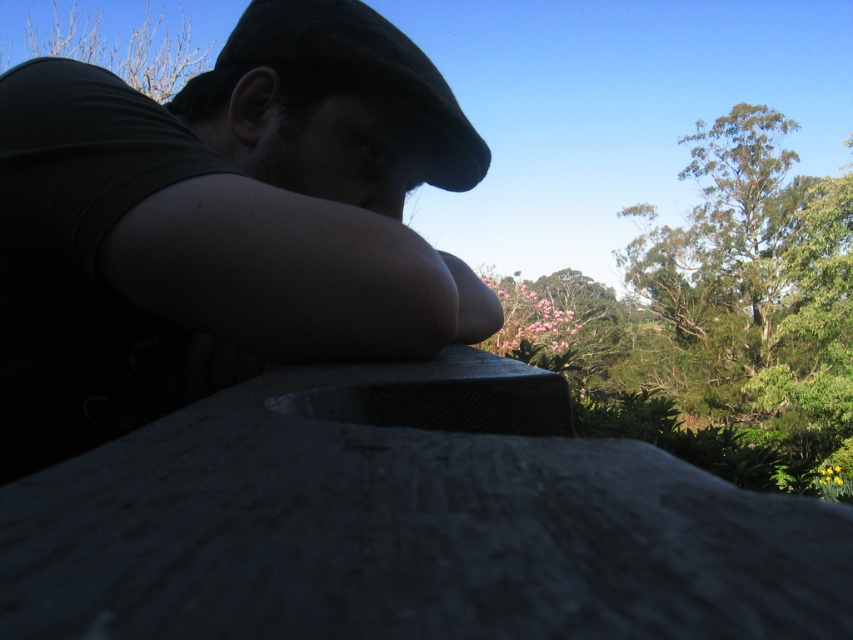
You are a photographer trying to capture the best angle of the scene. You notice two points in the image labeled as point [695,282] and point [64,13]. Which point is closer to your camera lens?

Point [64,13] is closer to the camera lens because the description states that point [695,282] is further away than point [64,13].

You are an observer looking at the scene. You notice the green leafy tree at upper right and the bare branches at upper left. Which of these two objects is closer to you?

The green leafy tree at upper right is closer to you because it is in front of the bare branches at upper left.

What object is located at the coordinates point (222, 225) in the image?

The object at point (222, 225) is the matte black cap at upper center.